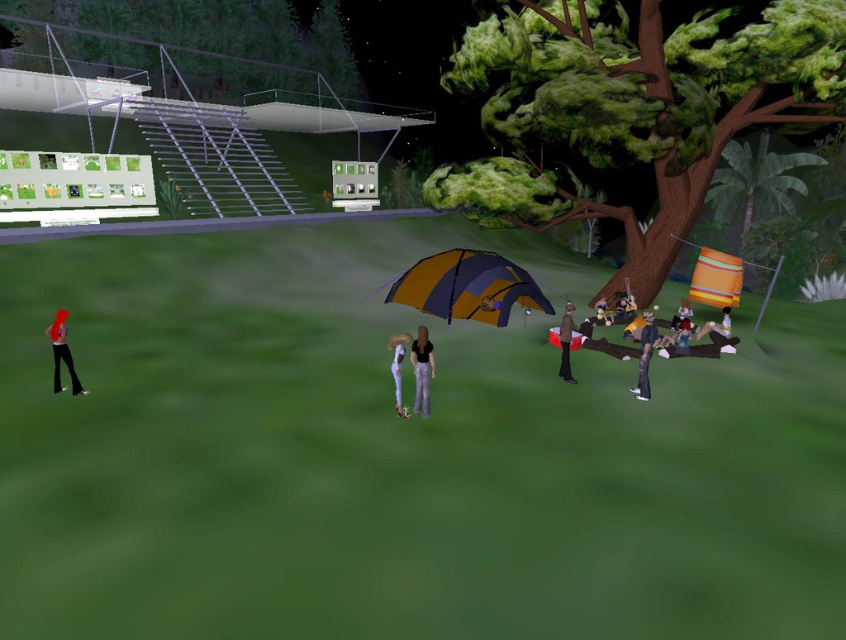
You are an observer standing at the edge of the grassy area where the characters are gathered. You need to determine which object is taller between the green leafy tree at upper center and the orange fabric bag at center right. Based on the scene, which one is taller?

The green leafy tree at upper center is taller than the orange fabric bag at center right.

Based on the photo, you are an observer standing in the middle of the scene. You notice the green leafy tree at upper center and the matte black jacket at center. Which object is positioned higher in the scene?

The green leafy tree at upper center is positioned higher than the matte black jacket at center.